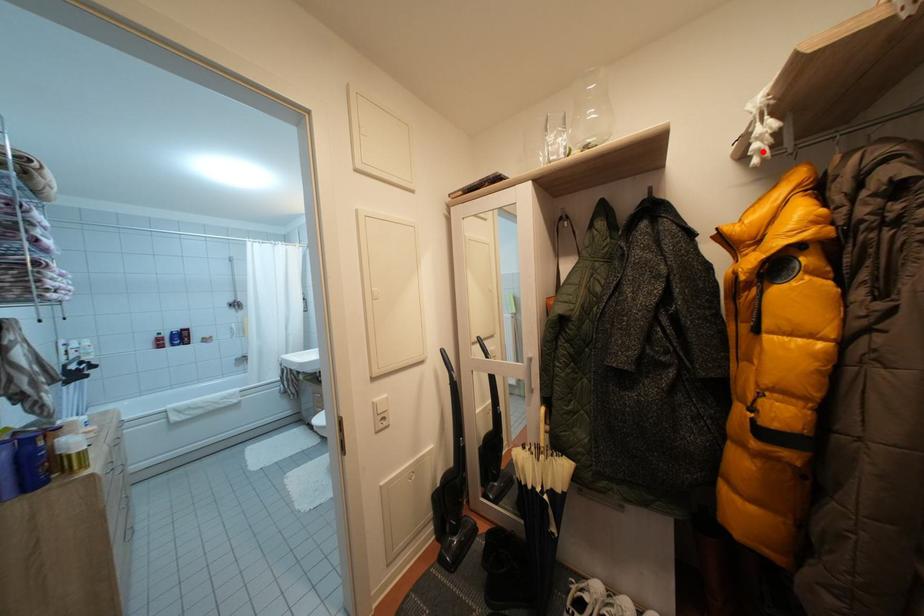
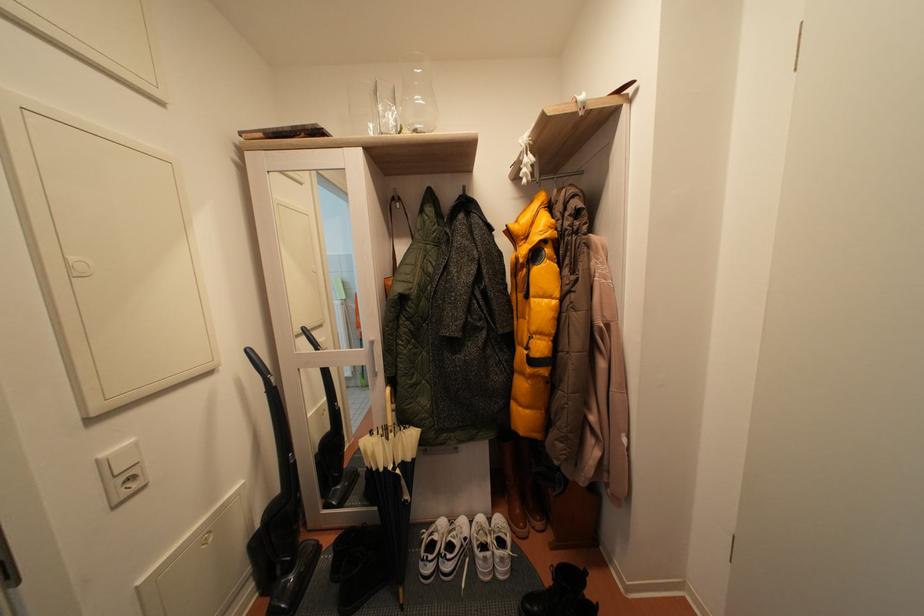
Question: I am providing you with two images of the same scene from different viewpoints. A red point is marked on the first image. At the location where the point appears in image 1, is it still visible in image 2?

Choices:
 (A) Yes
 (B) No

Answer: (A)